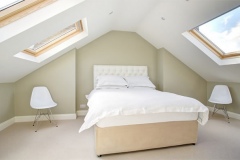
The height and width of the screenshot is (160, 240). Identify the location of comforter. (147, 102).